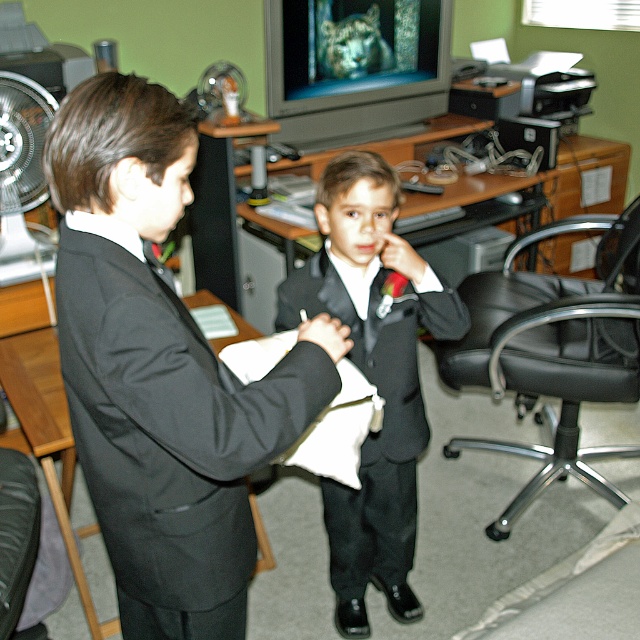
Question: Which point is farther to the camera?

Choices:
 (A) (552, 465)
 (B) (8, 150)
 (C) (387, 454)

Answer: (A)

Question: Which of the following is the closest to the observer?

Choices:
 (A) (17, 176)
 (B) (211, 452)

Answer: (B)

Question: Does black leather swivel chair at right have a lesser width compared to brushed metal fan at left?

Choices:
 (A) yes
 (B) no

Answer: (B)

Question: Which point is farther to the camera?

Choices:
 (A) black leather swivel chair at right
 (B) brushed metal fan at left
 (C) shiny black suit at center
 (D) matte black suit at center

Answer: (B)

Question: Can you confirm if shiny black suit at center is positioned above brushed metal fan at left?

Choices:
 (A) yes
 (B) no

Answer: (B)

Question: Is shiny black suit at center below black leather swivel chair at right?

Choices:
 (A) no
 (B) yes

Answer: (B)